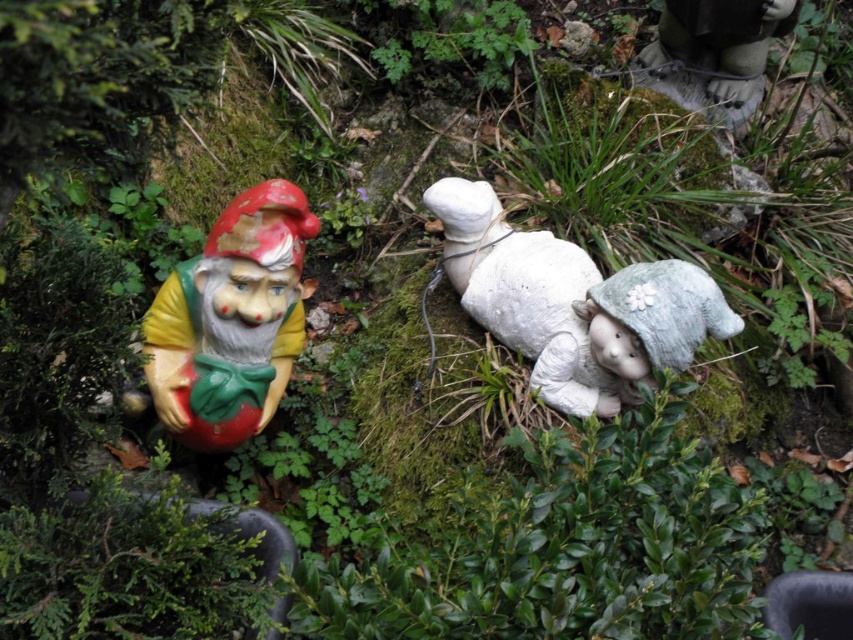
Who is more distant from viewer, (224, 211) or (531, 316)?

Point (531, 316)

At what (x,y) coordinates should I click in order to perform the action: click on matte plastic gnome at left. Please return your answer as a coordinate pair (x, y). The image size is (853, 640). Looking at the image, I should click on (231, 316).